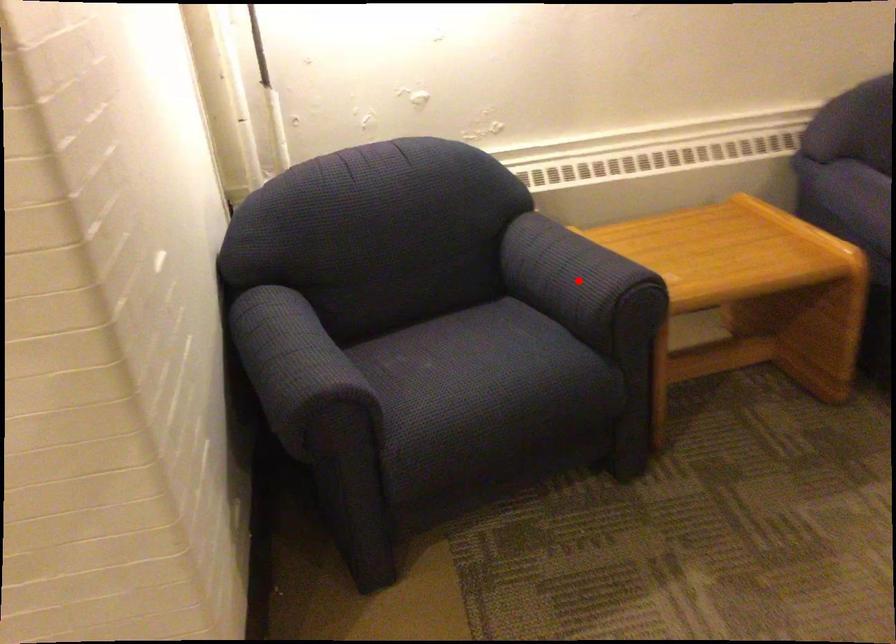
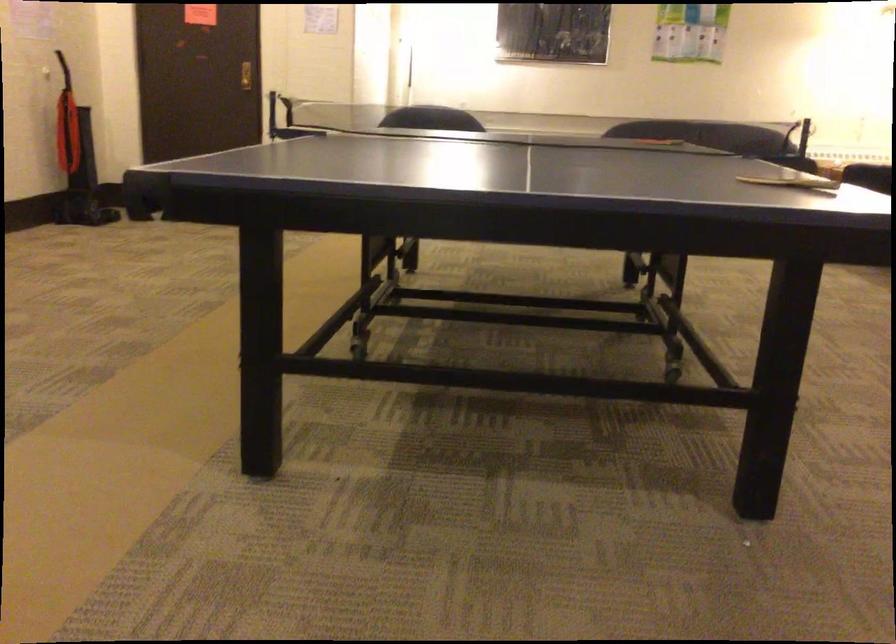
Question: I am providing you with two images of the same scene from different viewpoints. A red point is marked on the first image. At the location where the point appears in image 1, is it still visible in image 2?

Choices:
 (A) Yes
 (B) No

Answer: (B)